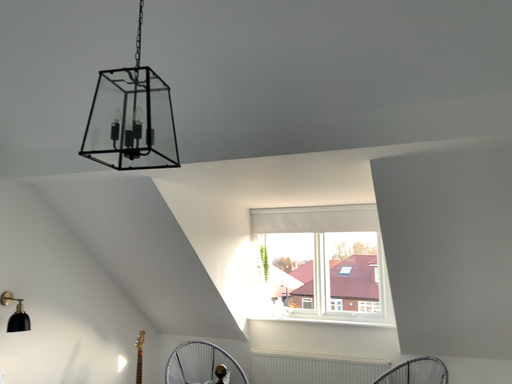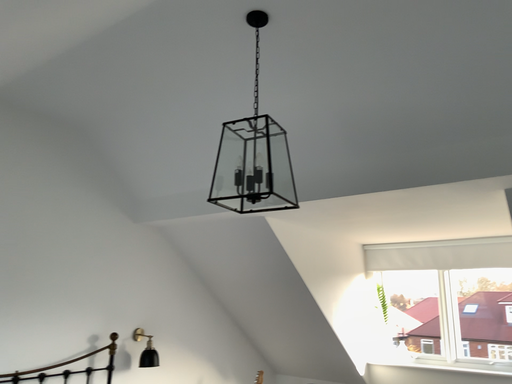
Question: Which way did the camera rotate in the video?

Choices:
 (A) rotated left
 (B) rotated right

Answer: (A)